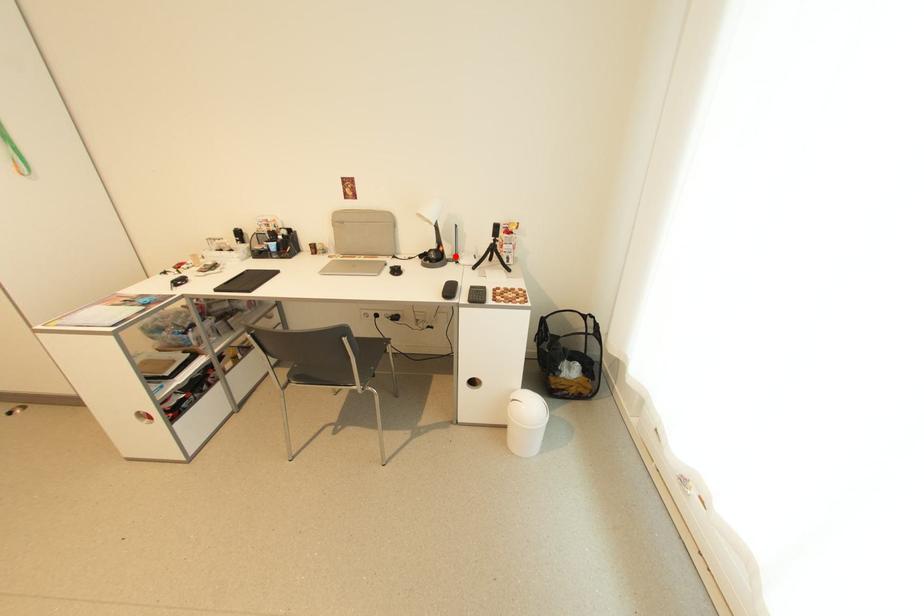
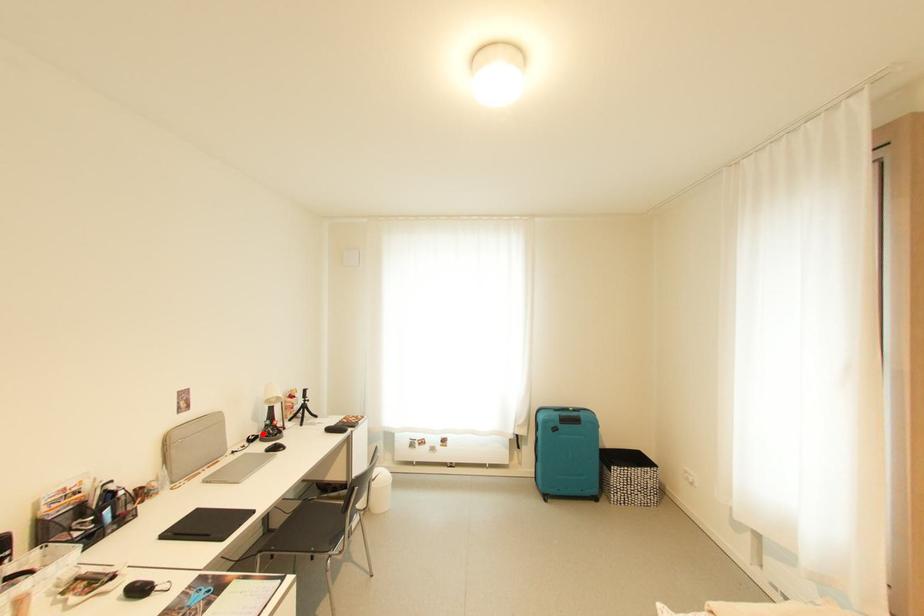
I am providing you with two images of the same scene from different viewpoints. A red point is marked on the first image and another point is marked on the second image. Does the point marked in image1 correspond to the same location as the one in image2?

Yes